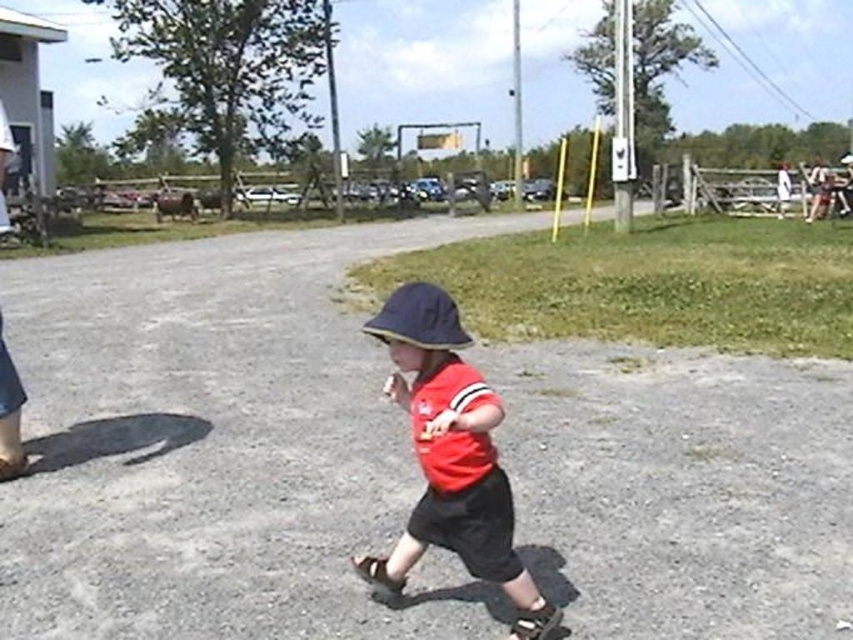
Is gray gravel road at center shorter than navy blue fabric baseball hat at center?

Incorrect, gray gravel road at center's height does not fall short of navy blue fabric baseball hat at center's.

Between gray gravel road at center and navy blue fabric baseball hat at center, which one has less height?

Standing shorter between the two is navy blue fabric baseball hat at center.

Is point (291, 432) less distant than point (428, 348)?

No, (291, 432) is further to viewer.

Locate an element on the screen. This screenshot has height=640, width=853. gray gravel road at center is located at coordinates (216, 445).

Does gray gravel road at center appear under red matte hat at center?

Actually, gray gravel road at center is above red matte hat at center.

Is point (302, 452) less distant than point (444, 376)?

No, it is not.

What are the coordinates of `gray gravel road at center` in the screenshot? It's located at (216, 445).

Can you confirm if red matte hat at center is shorter than navy blue fabric baseball hat at center?

Incorrect, red matte hat at center's height does not fall short of navy blue fabric baseball hat at center's.

From the picture: Which of these two, red matte hat at center or navy blue fabric baseball hat at center, stands shorter?

navy blue fabric baseball hat at center

Does point (425, 540) lie behind point (405, 332)?

That is True.

Locate an element on the screen. The height and width of the screenshot is (640, 853). red matte hat at center is located at coordinates (451, 456).